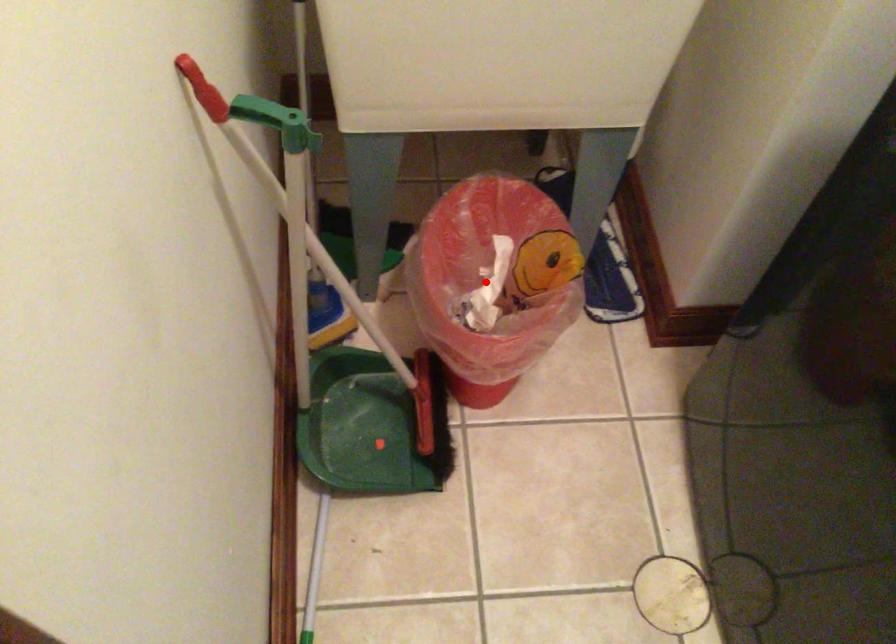
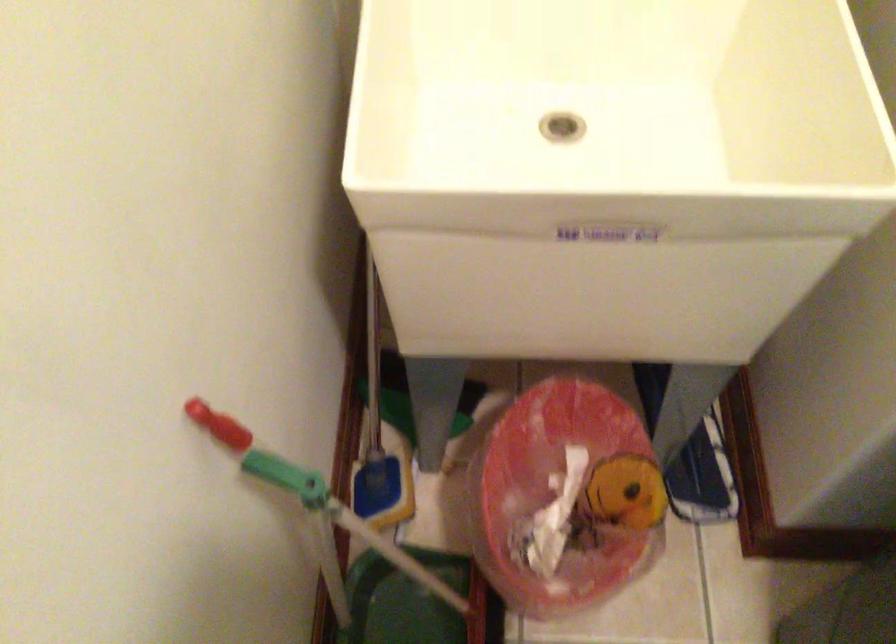
Question: A red point is marked in image1. In image2, is the corresponding 3D point closer to the camera or farther? Reply with the corresponding letter.

Choices:
 (A) The corresponding 3D point is closer.
 (B) The corresponding 3D point is farther.

Answer: (A)